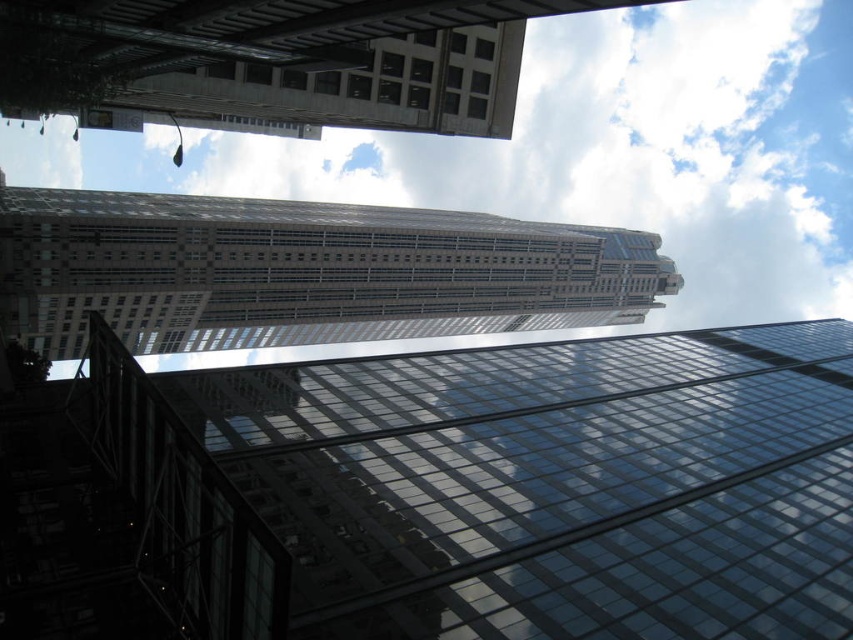
You are an architect observing the cityscape. You notice the white fluffy cloud at upper center and the glassy steel skyscraper at upper center. Which of these two objects is located higher in the sky?

The white fluffy cloud at upper center is positioned over the glassy steel skyscraper at upper center, meaning it is higher in the sky.

You are a drone operator who needs to fly a drone between the transparent glass building at center and the beige skyscraper in the midground. What is the minimum distance the drone must maintain between them to avoid collision?

The minimum distance the drone must maintain between the transparent glass building at center and the beige skyscraper in the midground is 16.68 meters to avoid collision.

You are an architect analyzing the cityscape. You need to determine which of the two buildings, the transparent glass building at center or the glassy steel skyscraper at upper center, has a narrower width. Which one is it?

The transparent glass building at center is thinner than the glassy steel skyscraper at upper center, so the transparent glass building at center has a narrower width.